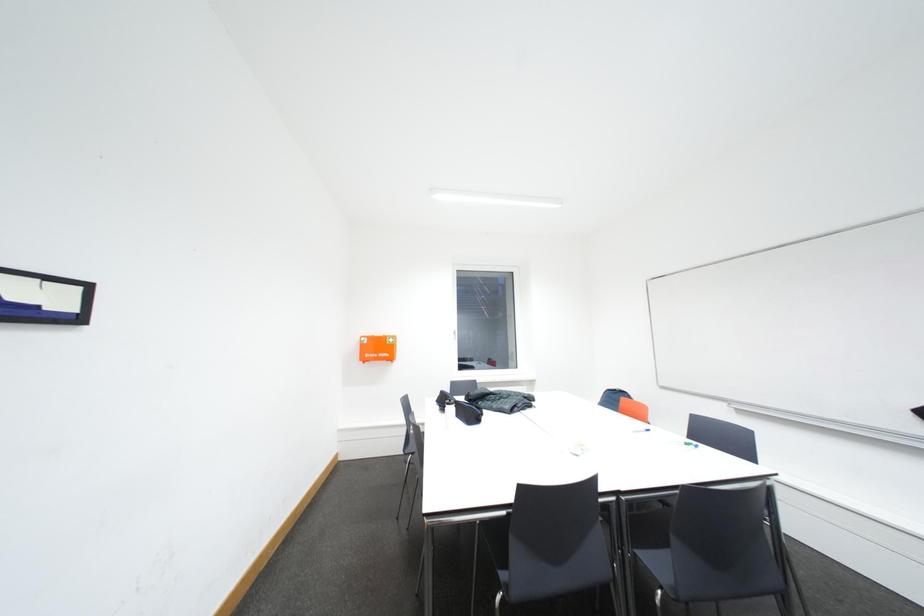
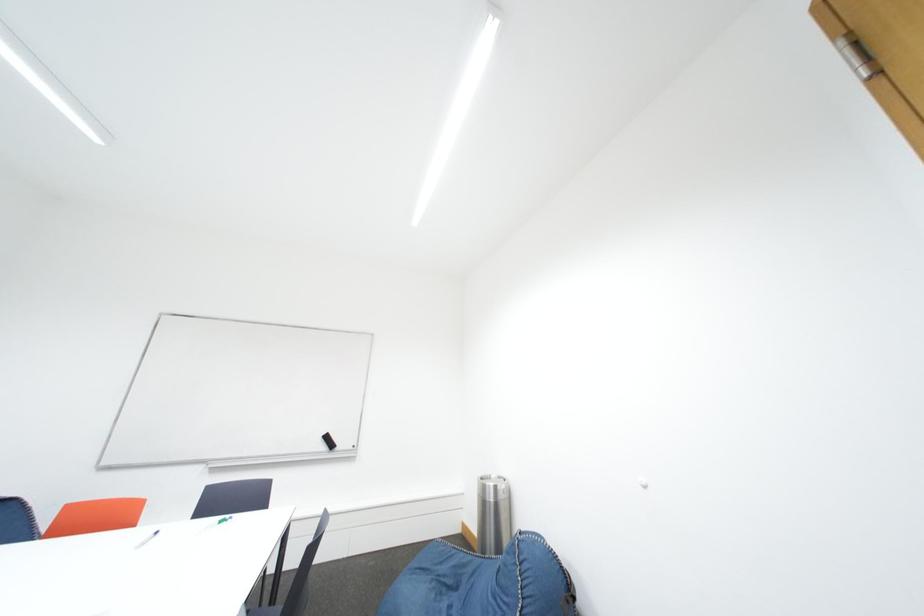
How did the camera likely rotate?

The rotation direction of the camera is right-up.